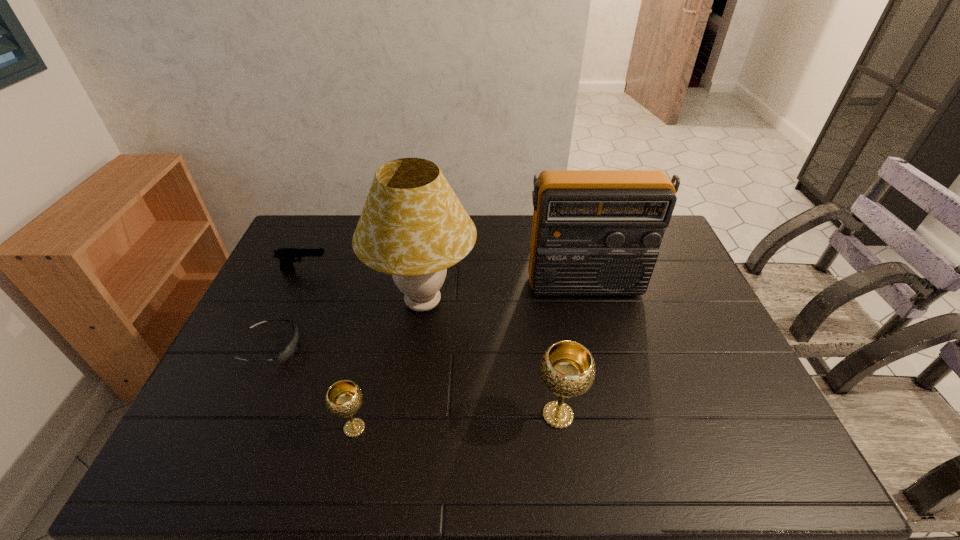
The height and width of the screenshot is (540, 960). In the image, there is a desktop. Find the location of `vacant space at the far left corner`. vacant space at the far left corner is located at coordinates (303, 218).

The width and height of the screenshot is (960, 540). Find the location of `free space at the far right corner of the desktop`. free space at the far right corner of the desktop is located at coordinates (665, 234).

Identify the location of free space between the lampshade and the radio receiver. This screenshot has height=540, width=960. (504, 294).

The width and height of the screenshot is (960, 540). I want to click on free spot between the lampshade and the fourth shortest object, so click(x=491, y=359).

The image size is (960, 540). I want to click on blank region between the right chalice and the fifth tallest object, so click(431, 342).

The height and width of the screenshot is (540, 960). Find the location of `unoccupied position between the lampshade and the goggles`. unoccupied position between the lampshade and the goggles is located at coordinates (348, 325).

At what (x,y) coordinates should I click in order to perform the action: click on vacant point located between the goggles and the pistol. Please return your answer as a coordinate pair (x, y). Looking at the image, I should click on (288, 309).

Image resolution: width=960 pixels, height=540 pixels. Identify the location of free space between the left chalice and the taller chalice. (456, 422).

What are the coordinates of `vacant region between the pistol and the lampshade` in the screenshot? It's located at (364, 286).

Where is `unoccupied area between the shorter chalice and the shortest object`? The image size is (960, 540). unoccupied area between the shorter chalice and the shortest object is located at coordinates (313, 388).